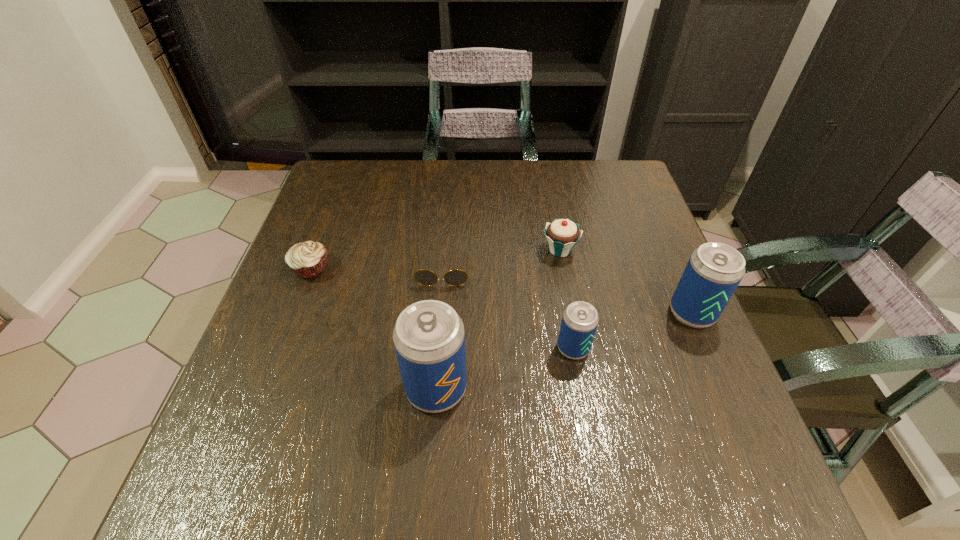
Identify the location of vacant space at the near edge of the desktop. Image resolution: width=960 pixels, height=540 pixels. (453, 434).

This screenshot has height=540, width=960. I want to click on free point at the left edge, so click(341, 241).

Locate an element on the screen. This screenshot has width=960, height=540. free space at the right edge of the desktop is located at coordinates (628, 211).

Locate an element on the screen. The height and width of the screenshot is (540, 960). free space at the far left corner of the desktop is located at coordinates (341, 161).

Identify the location of free space at the far right corner. (598, 174).

Where is `free area in between the shortest object and the third shortest object`? This screenshot has height=540, width=960. free area in between the shortest object and the third shortest object is located at coordinates (501, 260).

This screenshot has height=540, width=960. Identify the location of vacant space that is in between the third shortest object and the leftmost object. (436, 259).

Identify the location of empty space that is in between the nearest object and the third shortest object. (498, 319).

Where is `free spot between the shortest beer can and the cupcake`? This screenshot has height=540, width=960. free spot between the shortest beer can and the cupcake is located at coordinates (566, 299).

Locate an element on the screen. This screenshot has width=960, height=540. vacant area that lies between the third shortest object and the shortest beer can is located at coordinates (566, 299).